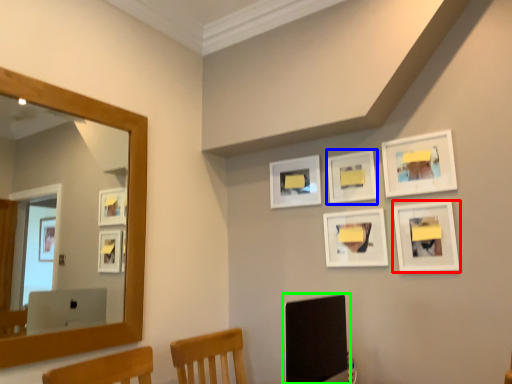
Question: Based on their relative distances, which object is farther from picture frame (highlighted by a red box)? Choose from picture frame (highlighted by a blue box) and computer monitor (highlighted by a green box).

Choices:
 (A) picture frame
 (B) computer monitor

Answer: (B)